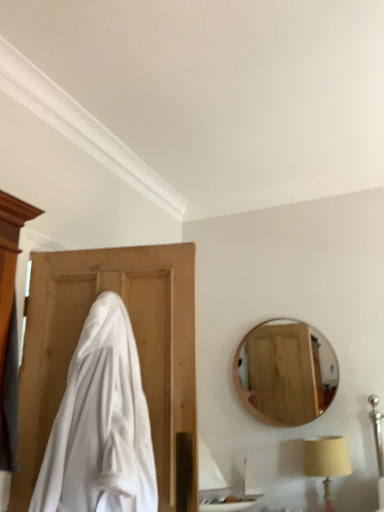
The height and width of the screenshot is (512, 384). What do you see at coordinates (285, 372) in the screenshot?
I see `wooden mirror at upper right` at bounding box center [285, 372].

The image size is (384, 512). In order to click on wooden mirror at upper right in this screenshot , I will do [x=285, y=372].

You are a GUI agent. You are given a task and a screenshot of the screen. Output one action in this format:
    pyautogui.click(x=<x>, y=<y>)
    Task: Click on the white glossy sink at lower center
    The height and width of the screenshot is (512, 384).
    Given the screenshot: What is the action you would take?
    pyautogui.click(x=218, y=486)

The width and height of the screenshot is (384, 512). I want to click on wooden mirror at upper right, so click(285, 372).

Which point is more forward, (58, 438) or (207, 488)?

Positioned in front is point (58, 438).

From a real-world perspective, does white cloth at left stand above white glossy sink at lower center?

Yes, from a real-world perspective, white cloth at left is on top of white glossy sink at lower center.

Could you tell me if white cloth at left is facing white glossy sink at lower center?

No.

Consider the image. In terms of size, does white cloth at left appear bigger or smaller than white glossy sink at lower center?

white cloth at left is bigger than white glossy sink at lower center.

Considering the sizes of objects wooden mirror at upper right and white glossy sink at lower center in the image provided, who is thinner, wooden mirror at upper right or white glossy sink at lower center?

wooden mirror at upper right.

From a real-world perspective, is wooden mirror at upper right located beneath white glossy sink at lower center?

No, from a real-world perspective, wooden mirror at upper right is not beneath white glossy sink at lower center.

From the image's perspective, is wooden mirror at upper right on top of white glossy sink at lower center?

Indeed, from the image's perspective, wooden mirror at upper right is shown above white glossy sink at lower center.

From the picture: Is white glossy sink at lower center with wooden mirror at upper right?

white glossy sink at lower center and wooden mirror at upper right are not in contact.

Can you confirm if white glossy sink at lower center is taller than wooden mirror at upper right?

Incorrect, the height of white glossy sink at lower center is not larger of that of wooden mirror at upper right.

Which is behind, point (218, 494) or point (326, 380)?

The point (218, 494) is behind.

Measure the distance between wooden mirror at upper right and white cloth at left.

wooden mirror at upper right is 1.79 meters away from white cloth at left.

Is point (285, 414) in front of point (82, 446)?

No, (285, 414) is further to viewer.

Considering the relative sizes of wooden mirror at upper right and white cloth at left in the image provided, is wooden mirror at upper right shorter than white cloth at left?

Yes, wooden mirror at upper right is shorter than white cloth at left.

Looking at this image, do you think wooden mirror at upper right is within white cloth at left, or outside of it?

wooden mirror at upper right lies outside white cloth at left.

Is white glossy sink at lower center completely or partially outside of beige fabric lampshade at lower right?

That's correct, white glossy sink at lower center is outside of beige fabric lampshade at lower right.

Can you confirm if white glossy sink at lower center is positioned to the left of beige fabric lampshade at lower right?

Correct, you'll find white glossy sink at lower center to the left of beige fabric lampshade at lower right.

Is white glossy sink at lower center far away from beige fabric lampshade at lower right?

They are positioned close to each other.

From the image's perspective, is white glossy sink at lower center located above or below beige fabric lampshade at lower right?

Clearly, from the image's perspective, white glossy sink at lower center is below beige fabric lampshade at lower right.

Between point (311, 471) and point (56, 424), which one is positioned behind?

Point (311, 471)

Is beige fabric lampshade at lower right inside or outside of white cloth at left?

beige fabric lampshade at lower right is outside white cloth at left.

From a real-world perspective, is beige fabric lampshade at lower right physically below white cloth at left?

Yes, from a real-world perspective, beige fabric lampshade at lower right is under white cloth at left.

How much distance is there between beige fabric lampshade at lower right and white cloth at left?

The distance of beige fabric lampshade at lower right from white cloth at left is 5.88 feet.

From a real-world perspective, is beige fabric lampshade at lower right under white glossy sink at lower center?

Yes, from a real-world perspective, beige fabric lampshade at lower right is under white glossy sink at lower center.

How distant is beige fabric lampshade at lower right from white glossy sink at lower center?

beige fabric lampshade at lower right and white glossy sink at lower center are 24.13 inches apart.

Which is more distant, (311, 460) or (241, 494)?

The point (241, 494) is farther from the camera.

I want to click on cloak to the left of white glossy sink at lower center, so click(100, 424).

In the image, there is a wooden mirror at upper right. At what (x,y) coordinates should I click in order to perform the action: click on sink below it (from a real-world perspective). Please return your answer as a coordinate pair (x, y). This screenshot has height=512, width=384. Looking at the image, I should click on (218, 486).

Based on their spatial positions, is white glossy sink at lower center or wooden mirror at upper right further from beige fabric lampshade at lower right?

white glossy sink at lower center is positioned further to the anchor beige fabric lampshade at lower right.

Considering their positions, is white cloth at left positioned further to wooden mirror at upper right than white glossy sink at lower center?

Among the two, white cloth at left is located further to wooden mirror at upper right.

Estimate the real-world distances between objects in this image. Which object is closer to white glossy sink at lower center, wooden mirror at upper right or beige fabric lampshade at lower right?

Based on the image, beige fabric lampshade at lower right appears to be nearer to white glossy sink at lower center.

From the image, which object appears to be farther from white cloth at left, beige fabric lampshade at lower right or white glossy sink at lower center?

beige fabric lampshade at lower right.

Considering their positions, is white cloth at left positioned further to beige fabric lampshade at lower right than white glossy sink at lower center?

white cloth at left lies further to beige fabric lampshade at lower right than the other object.

Estimate the real-world distances between objects in this image. Which object is further from wooden mirror at upper right, beige fabric lampshade at lower right or white glossy sink at lower center?

white glossy sink at lower center.

Looking at the image, which one is located further to white cloth at left, beige fabric lampshade at lower right or wooden mirror at upper right?

Among the two, beige fabric lampshade at lower right is located further to white cloth at left.

Considering their positions, is wooden mirror at upper right positioned closer to white cloth at left than white glossy sink at lower center?

Among the two, white glossy sink at lower center is located nearer to white cloth at left.

This screenshot has width=384, height=512. In order to click on sink between white cloth at left and wooden mirror at upper right from front to back in this screenshot , I will do `click(218, 486)`.

The height and width of the screenshot is (512, 384). Find the location of `table lamp located between white cloth at left and white glossy sink at lower center in the depth direction`. table lamp located between white cloth at left and white glossy sink at lower center in the depth direction is located at coordinates (326, 462).

The width and height of the screenshot is (384, 512). What are the coordinates of `table lamp between white cloth at left and wooden mirror at upper right in the front-back direction` in the screenshot? It's located at (326, 462).

This screenshot has height=512, width=384. I want to click on table lamp between wooden mirror at upper right and white glossy sink at lower center in the up-down direction, so click(x=326, y=462).